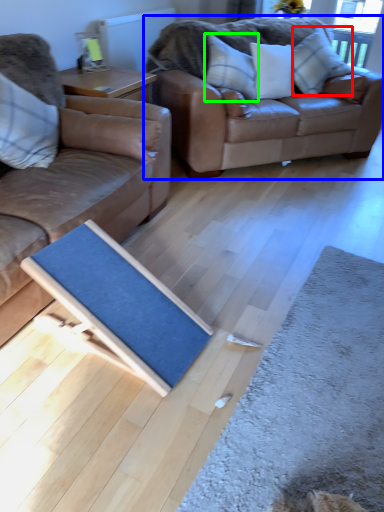
Question: Considering the real-world distances, which object is farthest from pillow (highlighted by a red box)? studio couch (highlighted by a blue box) or pillow (highlighted by a green box)?

Choices:
 (A) studio couch
 (B) pillow

Answer: (B)